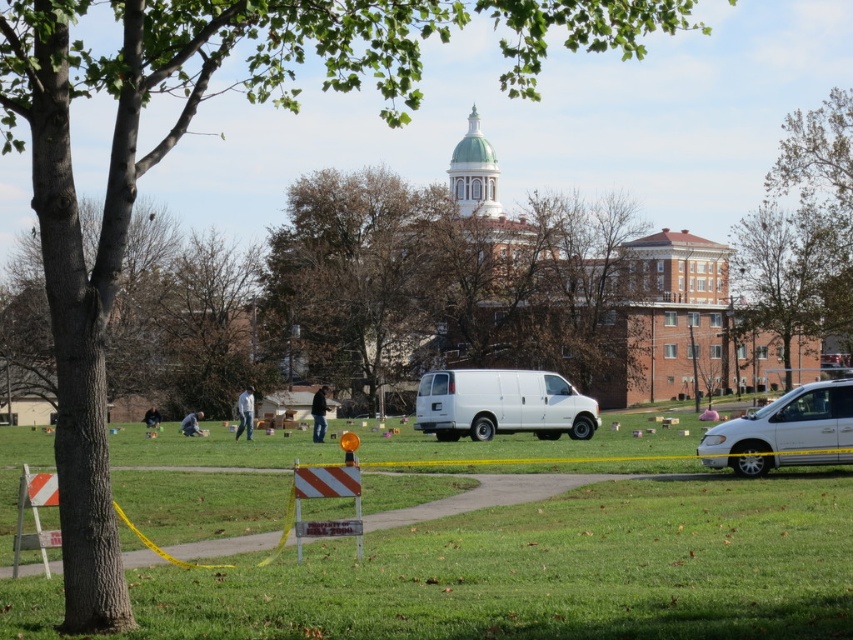
You are a delivery person who needs to place a large package on the ground near the white matte van at center and the black leather jacket at center. Which object should you place the package closer to if you want it to be more visible from the road?

The white matte van at center is above the black leather jacket at center, so placing the package near the van would make it more visible from the road since it is higher up.

You are a delivery person who needs to place a package between the jeans at center and the black leather jacket at center. Can you fit the package in the space between them if the package is 10 feet long?

The jeans at center and black leather jacket at center are 11.53 feet apart, so yes, the package can fit between them since 10 feet is shorter than the available space.

You are a delivery person trying to park your truck in this area. You see the white matte van at lower right and the dark gray fabric at lower left. Which object takes up more space in the parking area?

The dark gray fabric at lower left occupies more space than the white matte van at lower right.